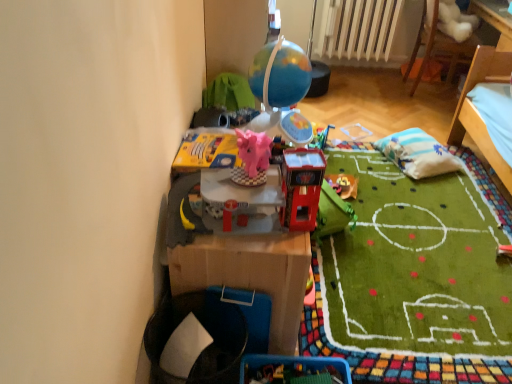
In order to face striped fabric pillow at center right, should I rotate leftwards or rightwards?

Rotate your view right by about 20.884°.

Describe the element at coordinates (252, 158) in the screenshot. This screenshot has width=512, height=384. I see `matte pink elephant at center, arranged as the 3th toy when viewed from the right` at that location.

Image resolution: width=512 pixels, height=384 pixels. Describe the element at coordinates (343, 185) in the screenshot. I see `shiny plastic toy at center, placed as the 1th toy when sorted from back to front` at that location.

You are a GUI agent. You are given a task and a screenshot of the screen. Output one action in this format:
    pyautogui.click(x=<x>, y=<y>)
    Task: Click on the shiny plastic toy at center, placed as the 1th toy when sorted from back to front
    The height and width of the screenshot is (384, 512).
    Given the screenshot: What is the action you would take?
    pyautogui.click(x=343, y=185)

Find the location of a particular element. This screenshot has width=512, height=384. shiny plastic toy at center, acting as the second toy starting from the left is located at coordinates (301, 187).

Locate an element on the screen. The height and width of the screenshot is (384, 512). striped fabric pillow at center right is located at coordinates (417, 154).

Does white plastic radiator at upper center have a greater width compared to shiny plastic toy at center, which appears as the first toy when viewed from the right?

In fact, white plastic radiator at upper center might be narrower than shiny plastic toy at center, which appears as the first toy when viewed from the right.

From the image's perspective, would you say white plastic radiator at upper center is positioned over shiny plastic toy at center, which appears as the first toy when viewed from the right?

Yes, from the image's perspective, white plastic radiator at upper center is on top of shiny plastic toy at center, which appears as the first toy when viewed from the right.

Considering the relative sizes of white plastic radiator at upper center and shiny plastic toy at center, which appears as the first toy when viewed from the right, in the image provided, is white plastic radiator at upper center bigger than shiny plastic toy at center, which appears as the first toy when viewed from the right,?

Yes.

In terms of height, does white plastic radiator at upper center look taller or shorter compared to shiny plastic toy at center, arranged as the third toy when viewed from the front?

white plastic radiator at upper center is taller than shiny plastic toy at center, arranged as the third toy when viewed from the front.

Is matte pink elephant at center, the second toy in the front-to-back sequence, taller or shorter than white plush toy at upper right?

In the image, matte pink elephant at center, the second toy in the front-to-back sequence, appears to be shorter than white plush toy at upper right.

Is matte pink elephant at center, arranged as the 3th toy when viewed from the right, smaller than white plush toy at upper right?

Correct, matte pink elephant at center, arranged as the 3th toy when viewed from the right, occupies less space than white plush toy at upper right.

Considering the positions of points (251, 173) and (470, 51), is point (251, 173) closer to camera compared to point (470, 51)?

Yes, it is in front of point (470, 51).

This screenshot has height=384, width=512. I want to click on furniture above the matte pink elephant at center, the first toy viewed from the left (from the image's perspective), so click(x=438, y=44).

Can you confirm if shiny plastic toy at center, arranged as the 1th toy when viewed from the front, is wider than white plastic radiator at upper center?

Incorrect, the width of shiny plastic toy at center, arranged as the 1th toy when viewed from the front, does not surpass that of white plastic radiator at upper center.

This screenshot has height=384, width=512. What are the coordinates of `radiator that appears behind the shiny plastic toy at center, acting as the second toy starting from the left` in the screenshot? It's located at (358, 29).

Can we say shiny plastic toy at center, acting as the second toy starting from the left, lies outside white plastic radiator at upper center?

Yes, shiny plastic toy at center, acting as the second toy starting from the left, is outside of white plastic radiator at upper center.

Considering the positions of objects white plush toy at upper right and shiny plastic toy at center, the second toy positioned from the right, in the image provided, who is behind, white plush toy at upper right or shiny plastic toy at center, the second toy positioned from the right,?

white plush toy at upper right.

Considering the relative positions of white plush toy at upper right and shiny plastic toy at center, the 3th toy positioned from the back, in the image provided, is white plush toy at upper right to the left of shiny plastic toy at center, the 3th toy positioned from the back, from the viewer's perspective?

Incorrect, white plush toy at upper right is not on the left side of shiny plastic toy at center, the 3th toy positioned from the back.

Does white plush toy at upper right have a greater width compared to shiny plastic toy at center, the 3th toy positioned from the back?

Yes, white plush toy at upper right is wider than shiny plastic toy at center, the 3th toy positioned from the back.

Can you confirm if shiny plastic toy at center, the 3th toy positioned from the back, is taller than white plush toy at upper right?

Incorrect, the height of shiny plastic toy at center, the 3th toy positioned from the back, is not larger of that of white plush toy at upper right.

Considering the points (286, 150) and (423, 28), which point is behind, point (286, 150) or point (423, 28)?

The point (423, 28) is farther from the camera.

Looking at this image, is shiny plastic toy at center, arranged as the 1th toy when viewed from the front, placed right next to white plush toy at upper right?

There is a gap between shiny plastic toy at center, arranged as the 1th toy when viewed from the front, and white plush toy at upper right.

Looking at this image, which is more to the left, shiny plastic toy at center, the second toy positioned from the right, or white plush toy at upper right?

From the viewer's perspective, shiny plastic toy at center, the second toy positioned from the right, appears more on the left side.

Is point (269, 159) positioned after point (425, 156)?

No, it is in front of (425, 156).

From a real-world perspective, is matte pink elephant at center, the first toy viewed from the left, located beneath striped fabric pillow at center right?

No.

Is matte pink elephant at center, the second toy in the front-to-back sequence, next to striped fabric pillow at center right and touching it?

No, matte pink elephant at center, the second toy in the front-to-back sequence, is not touching striped fabric pillow at center right.

Consider the image. Does matte pink elephant at center, the first toy viewed from the left, have a greater height compared to striped fabric pillow at center right?

Correct, matte pink elephant at center, the first toy viewed from the left, is much taller as striped fabric pillow at center right.

From the image's perspective, is white plush toy at upper right below white plastic radiator at upper center?

Indeed, from the image's perspective, white plush toy at upper right is shown beneath white plastic radiator at upper center.

From a real-world perspective, is white plush toy at upper right physically located above or below white plastic radiator at upper center?

Clearly, from a real-world perspective, white plush toy at upper right is below white plastic radiator at upper center.

Is there a large distance between white plush toy at upper right and white plastic radiator at upper center?

Actually, white plush toy at upper right and white plastic radiator at upper center are a little close together.

In the image, there is a white plastic radiator at upper center. Where is `furniture below it (from a real-world perspective)`? The height and width of the screenshot is (384, 512). furniture below it (from a real-world perspective) is located at coordinates (438, 44).

I want to click on toy below the white plastic radiator at upper center (from a real-world perspective), so click(x=343, y=185).

Find the location of a particular element. This screenshot has width=512, height=384. the 2nd toy in front when counting from the white plush toy at upper right is located at coordinates (252, 158).

When comparing their distances from striped fabric pillow at center right, does white plush toy at upper right or white plastic radiator at upper center seem further?

white plastic radiator at upper center.

Looking at the image, which one is located further to shiny plastic toy at center, placed as the 1th toy when sorted from back to front, striped fabric pillow at center right or shiny plastic toy at center, the 3th toy positioned from the back?

shiny plastic toy at center, the 3th toy positioned from the back, is further to shiny plastic toy at center, placed as the 1th toy when sorted from back to front.

Which object lies further to the anchor point white plush toy at upper right, matte pink elephant at center, which is the second toy in back-to-front order, or shiny plastic toy at center, arranged as the 1th toy when viewed from the front?

matte pink elephant at center, which is the second toy in back-to-front order.

Considering their positions, is striped fabric pillow at center right positioned closer to white plush toy at upper right than shiny plastic toy at center, the second toy positioned from the right?

striped fabric pillow at center right is closer to white plush toy at upper right.

Which object lies further to the anchor point white plastic radiator at upper center, white plush toy at upper right or shiny plastic toy at center, which appears as the first toy when viewed from the right?

shiny plastic toy at center, which appears as the first toy when viewed from the right.

Considering their positions, is matte pink elephant at center, arranged as the 3th toy when viewed from the right, positioned closer to shiny plastic toy at center, the 3th toy positioned from the back, than shiny plastic toy at center, which appears as the first toy when viewed from the right?

matte pink elephant at center, arranged as the 3th toy when viewed from the right.

Based on their spatial positions, is matte pink elephant at center, arranged as the 3th toy when viewed from the right, or shiny plastic toy at center, the 3th toy positioned from the back, further from striped fabric pillow at center right?

matte pink elephant at center, arranged as the 3th toy when viewed from the right, is positioned further to the anchor striped fabric pillow at center right.

Based on the photo, when comparing their distances from shiny plastic toy at center, the third toy when ordered from left to right, does shiny plastic toy at center, the 3th toy positioned from the back, or white plastic radiator at upper center seem further?

Among the two, white plastic radiator at upper center is located further to shiny plastic toy at center, the third toy when ordered from left to right.

Where is `toy between matte pink elephant at center, which is the second toy in back-to-front order, and white plush toy at upper right in the front-back direction`? toy between matte pink elephant at center, which is the second toy in back-to-front order, and white plush toy at upper right in the front-back direction is located at coordinates (343, 185).

This screenshot has height=384, width=512. In order to click on toy between matte pink elephant at center, the first toy viewed from the left, and white plastic radiator at upper center from front to back in this screenshot , I will do `click(343, 185)`.

What are the coordinates of `furniture between shiny plastic toy at center, arranged as the 1th toy when viewed from the front, and white plastic radiator at upper center, along the z-axis` in the screenshot? It's located at (438, 44).

Where is `toy between shiny plastic toy at center, the second toy positioned from the right, and shiny plastic toy at center, which appears as the first toy when viewed from the right, along the z-axis`? The image size is (512, 384). toy between shiny plastic toy at center, the second toy positioned from the right, and shiny plastic toy at center, which appears as the first toy when viewed from the right, along the z-axis is located at coordinates (252, 158).